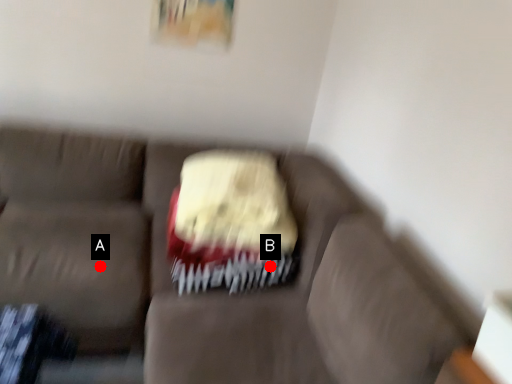
Question: Two points are circled on the image, labeled by A and B beside each circle. Which point appears farthest from the camera in this image?

Choices:
 (A) A is further
 (B) B is further

Answer: (B)